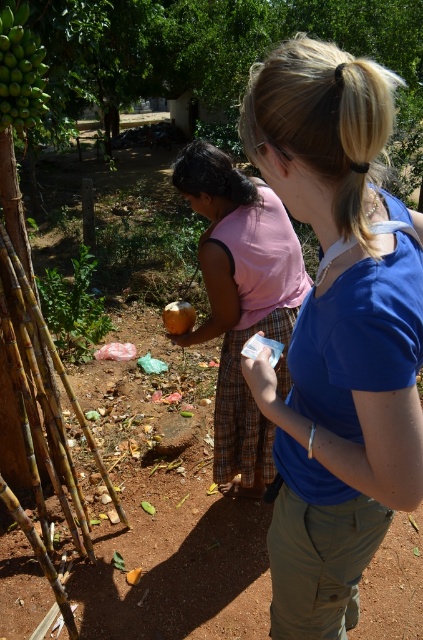
You are a traveler on a dirt path and see the green matte bananas at upper left and the smooth brown coconut at center. Which item is positioned to the left of the other?

The green matte bananas at upper left are positioned to the left of the smooth brown coconut at center.

In the scene shown: You are standing at the point with coordinates point (337, 332). Looking around, you see a blue cotton shirt at upper right and a pink sleeveless top at lower left. Which direction should you move to reach the blue cotton shirt at upper right?

The point (337, 332) corresponds to the blue cotton shirt at upper right, so you are already at that location.

You are a photographer trying to capture a photo of both the pink fabric dress at center and the green matte bananas at upper left in the same frame. Based on their heights, which object should you focus on first to ensure both are in the frame?

The pink fabric dress at center is taller than the green matte bananas at upper left. To ensure both are in the frame, focus on the pink fabric dress at center first as it requires more vertical space due to its greater height.